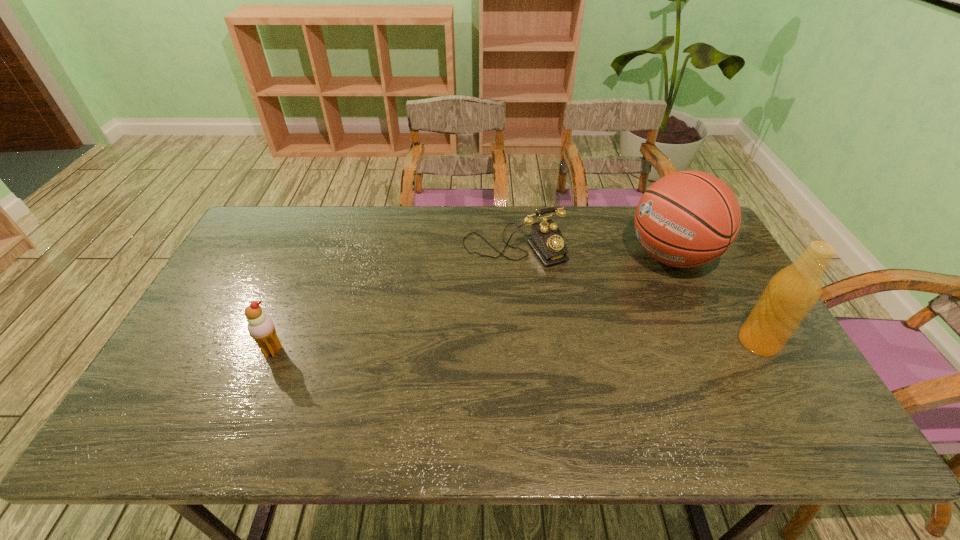
In order to click on vacant area at the near edge of the desktop in this screenshot , I will do `click(693, 379)`.

The height and width of the screenshot is (540, 960). In the image, there is a desktop. Identify the location of free space at the left edge. (185, 345).

The width and height of the screenshot is (960, 540). Identify the location of free space at the right edge of the desktop. (787, 373).

Where is `free space at the far left corner`? free space at the far left corner is located at coordinates (299, 226).

Identify the location of vacant space at the near left corner. (205, 403).

Identify the location of vacant area that lies between the basketball and the beer bottle. (715, 299).

You are a GUI agent. You are given a task and a screenshot of the screen. Output one action in this format:
    pyautogui.click(x=<x>, y=<y>)
    Task: Click on the vacant space in between the icecream and the beer bottle
    The width and height of the screenshot is (960, 540).
    Given the screenshot: What is the action you would take?
    pyautogui.click(x=516, y=346)

Identify the location of free space between the beer bottle and the telephone. The image size is (960, 540). (636, 294).

Find the location of a particular element. The width and height of the screenshot is (960, 540). vacant area between the telephone and the icecream is located at coordinates (394, 298).

Locate an element on the screen. The image size is (960, 540). free space between the second object from left to right and the beer bottle is located at coordinates (636, 294).